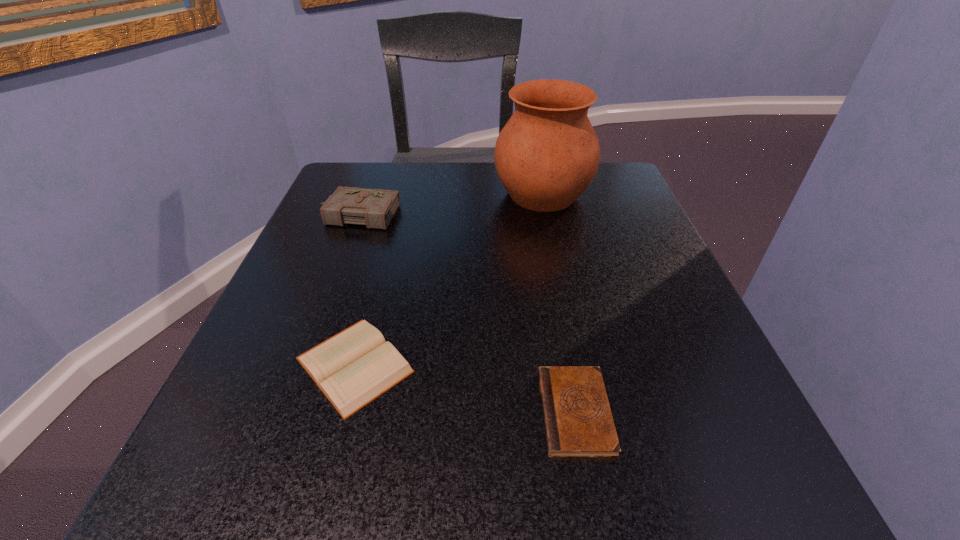
What are the coordinates of `free spot between the farthest diary and the shortest diary` in the screenshot? It's located at (467, 313).

Identify the location of empty space that is in between the farthest diary and the tallest object. (449, 204).

Where is `free space between the shortest diary and the second shortest object`? free space between the shortest diary and the second shortest object is located at coordinates (465, 388).

Identify the location of empty space between the pottery and the tallest diary. This screenshot has width=960, height=540. (449, 204).

You are a GUI agent. You are given a task and a screenshot of the screen. Output one action in this format:
    pyautogui.click(x=<x>, y=<y>)
    Task: Click on the free space that is in between the tallest diary and the second shortest object
    This screenshot has width=960, height=540.
    Given the screenshot: What is the action you would take?
    (x=356, y=290)

Locate which object is the third closest to the second shortest diary. Please provide its 2D coordinates. Your answer should be formatted as a tuple, i.e. [(x, y)], where the tuple contains the x and y coordinates of a point satisfying the conditions above.

[(547, 154)]

Identify the location of object that ranks as the closest to the pottery. (375, 208).

Find the location of a particular element. This screenshot has height=540, width=960. diary object that ranks as the second closest to the tallest diary is located at coordinates (578, 422).

Identify which diary is located as the second nearest to the rightmost diary. Please provide its 2D coordinates. Your answer should be formatted as a tuple, i.e. [(x, y)], where the tuple contains the x and y coordinates of a point satisfying the conditions above.

[(375, 208)]

Locate an element on the screen. The height and width of the screenshot is (540, 960). vacant space that satisfies the following two spatial constraints: 1. on the front side of the tallest object; 2. on the spine side of the rightmost diary is located at coordinates coord(588,412).